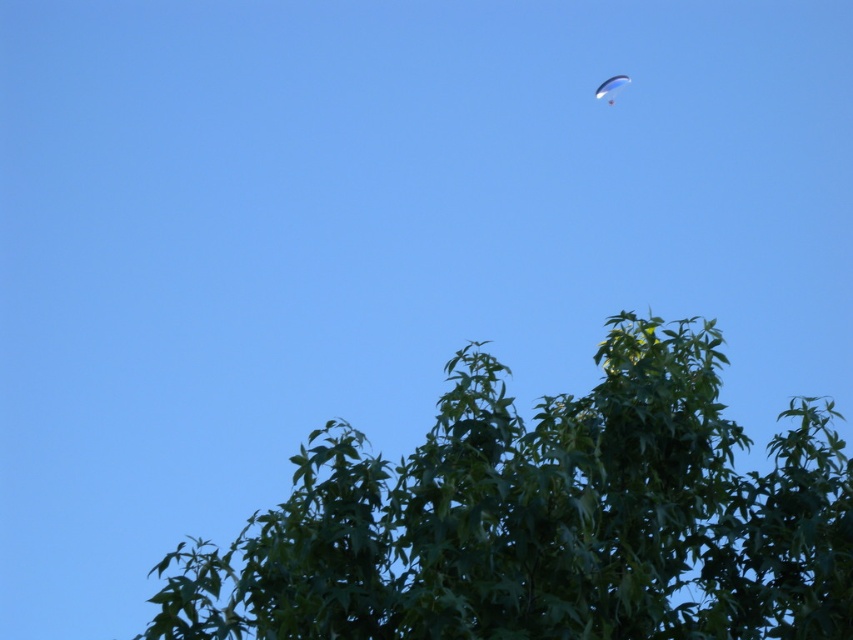
Is green leafy tree at center to the left of white glossy parachute at upper right from the viewer's perspective?

Indeed, green leafy tree at center is positioned on the left side of white glossy parachute at upper right.

Does green leafy tree at center appear over white glossy parachute at upper right?

No.

At what (x,y) coordinates should I click in order to perform the action: click on green leafy tree at center. Please return your answer as a coordinate pair (x, y). Looking at the image, I should click on (544, 518).

At what (x,y) coordinates should I click in order to perform the action: click on green leafy tree at center. Please return your answer as a coordinate pair (x, y). The width and height of the screenshot is (853, 640). Looking at the image, I should click on (544, 518).